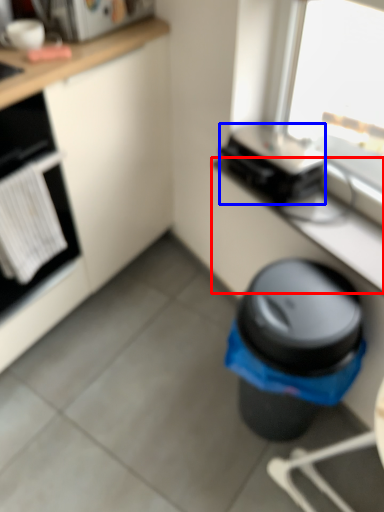
Question: Which object appears farthest to the camera in this image, counter top (highlighted by a red box) or appliance (highlighted by a blue box)?

Choices:
 (A) counter top
 (B) appliance

Answer: (B)